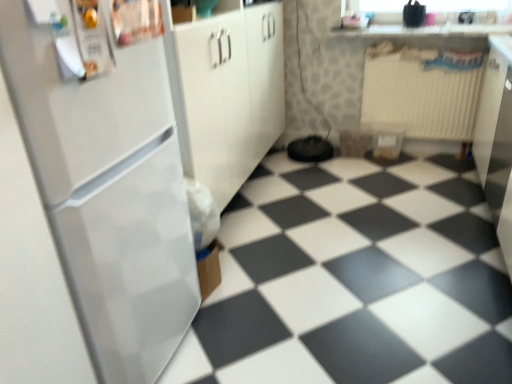
Locate an element on the screen. white glossy countertop at upper center is located at coordinates (424, 31).

Measure the distance between white glossy countertop at upper center and camera.

white glossy countertop at upper center and camera are 2.79 meters apart.

The width and height of the screenshot is (512, 384). I want to click on white plastic radiator at upper right, so click(x=421, y=90).

The height and width of the screenshot is (384, 512). Describe the element at coordinates (355, 279) in the screenshot. I see `white glossy tile at lower left` at that location.

Locate an element on the screen. white glossy countertop at upper center is located at coordinates (424, 31).

Considering the positions of point (472, 208) and point (41, 232), is point (472, 208) closer or farther from the camera than point (41, 232)?

Point (472, 208) is farther from the camera than point (41, 232).

Considering the relative sizes of white glossy tile at lower left and white glossy refrigerator at left in the image provided, is white glossy tile at lower left taller than white glossy refrigerator at left?

No.

At what (x,y) coordinates should I click in order to perform the action: click on tile behind the white glossy refrigerator at left. Please return your answer as a coordinate pair (x, y). This screenshot has height=384, width=512. Looking at the image, I should click on (355, 279).

Between white glossy tile at lower left and white glossy refrigerator at left, which one has larger width?

Wider between the two is white glossy tile at lower left.

Is white glossy tile at lower left oriented towards white glossy countertop at upper center?

No, white glossy tile at lower left is not facing towards white glossy countertop at upper center.

Is white glossy tile at lower left at the left side of white glossy countertop at upper center?

Yes, white glossy tile at lower left is to the left of white glossy countertop at upper center.

From the image's perspective, is white glossy tile at lower left positioned above or below white glossy countertop at upper center?

Based on their image positions, white glossy tile at lower left is located beneath white glossy countertop at upper center.

Between white glossy tile at lower left and white glossy countertop at upper center, which one has smaller size?

Smaller between the two is white glossy countertop at upper center.

Is white glossy tile at lower left completely or partially outside of white plastic radiator at upper right?

Indeed, white glossy tile at lower left is completely outside white plastic radiator at upper right.

Is white glossy tile at lower left taller or shorter than white plastic radiator at upper right?

In the image, white glossy tile at lower left appears to be shorter than white plastic radiator at upper right.

From the image's perspective, which one is positioned lower, white glossy tile at lower left or white plastic radiator at upper right?

white glossy tile at lower left, from the image's perspective.

Is white glossy tile at lower left touching white plastic radiator at upper right?

No, white glossy tile at lower left is not next to white plastic radiator at upper right.

Are white glossy refrigerator at left and white glossy countertop at upper center far apart?

Indeed, white glossy refrigerator at left is not near white glossy countertop at upper center.

Does white glossy refrigerator at left come behind white glossy countertop at upper center?

No.

Looking at this image, considering the relative positions of white glossy refrigerator at left and white glossy countertop at upper center in the image provided, is white glossy refrigerator at left to the left of white glossy countertop at upper center from the viewer's perspective?

Yes.

Based on the photo, is white glossy refrigerator at left located outside white glossy countertop at upper center?

Yes, white glossy refrigerator at left is not within white glossy countertop at upper center.

Is white plastic radiator at upper right positioned with its back to white glossy tile at lower left?

white plastic radiator at upper right does not have its back to white glossy tile at lower left.

From the image's perspective, does white plastic radiator at upper right appear higher than white glossy tile at lower left?

Yes, from the image's perspective, white plastic radiator at upper right is above white glossy tile at lower left.

Does white plastic radiator at upper right have a greater height compared to white glossy tile at lower left?

Correct, white plastic radiator at upper right is much taller as white glossy tile at lower left.

Is white plastic radiator at upper right further to the viewer compared to white glossy tile at lower left?

Yes, the depth of white plastic radiator at upper right is greater than that of white glossy tile at lower left.

Does white glossy refrigerator at left have a larger size compared to white plastic radiator at upper right?

Indeed, white glossy refrigerator at left has a larger size compared to white plastic radiator at upper right.

Could you tell me if white glossy refrigerator at left is facing white plastic radiator at upper right?

No, white glossy refrigerator at left is not facing towards white plastic radiator at upper right.

Looking at this image, does white glossy refrigerator at left have a greater width compared to white plastic radiator at upper right?

Yes, white glossy refrigerator at left is wider than white plastic radiator at upper right.

From the image's perspective, does white glossy countertop at upper center appear higher than white plastic radiator at upper right?

Indeed, from the image's perspective, white glossy countertop at upper center is shown above white plastic radiator at upper right.

Can you confirm if white glossy countertop at upper center is wider than white plastic radiator at upper right?

Indeed, white glossy countertop at upper center has a greater width compared to white plastic radiator at upper right.

Which is in front, white glossy countertop at upper center or white plastic radiator at upper right?

white glossy countertop at upper center is more forward.

How many degrees apart are the facing directions of white glossy countertop at upper center and white plastic radiator at upper right?

There is a 2.86-degree angle between the facing directions of white glossy countertop at upper center and white plastic radiator at upper right.

The width and height of the screenshot is (512, 384). In order to click on refrigerator on the left of the white glossy tile at lower left in this screenshot , I will do `click(89, 208)`.

Identify the location of tile below the white glossy countertop at upper center (from the image's perspective). (355, 279).

Considering their positions, is white plastic radiator at upper right positioned further to white glossy tile at lower left than white glossy refrigerator at left?

white plastic radiator at upper right lies further to white glossy tile at lower left than the other object.

Considering their positions, is white glossy countertop at upper center positioned closer to white glossy tile at lower left than white plastic radiator at upper right?

Based on the image, white plastic radiator at upper right appears to be nearer to white glossy tile at lower left.

When comparing their distances from white glossy refrigerator at left, does white glossy countertop at upper center or white plastic radiator at upper right seem further?

white glossy countertop at upper center.

From the image, which object appears to be farther from white plastic radiator at upper right, white glossy refrigerator at left or white glossy tile at lower left?

The object further to white plastic radiator at upper right is white glossy refrigerator at left.

Looking at the image, which one is located closer to white glossy tile at lower left, white glossy refrigerator at left or white glossy countertop at upper center?

Among the two, white glossy refrigerator at left is located nearer to white glossy tile at lower left.

Which object lies nearer to the anchor point white glossy countertop at upper center, white glossy tile at lower left or white glossy refrigerator at left?

white glossy tile at lower left.

Based on their spatial positions, is white glossy refrigerator at left or white glossy tile at lower left closer to white glossy countertop at upper center?

white glossy tile at lower left is positioned closer to the anchor white glossy countertop at upper center.

Which object lies nearer to the anchor point white glossy refrigerator at left, white plastic radiator at upper right or white glossy tile at lower left?

Among the two, white glossy tile at lower left is located nearer to white glossy refrigerator at left.

Locate an element on the screen. counter top positioned between white glossy tile at lower left and white plastic radiator at upper right from near to far is located at coordinates (424, 31).

The height and width of the screenshot is (384, 512). Find the location of `tile between white glossy refrigerator at left and white glossy countertop at upper center from front to back`. tile between white glossy refrigerator at left and white glossy countertop at upper center from front to back is located at coordinates (355, 279).

Where is `counter top positioned between white glossy refrigerator at left and white plastic radiator at upper right from near to far`? counter top positioned between white glossy refrigerator at left and white plastic radiator at upper right from near to far is located at coordinates (424, 31).

This screenshot has width=512, height=384. In order to click on tile positioned between white glossy refrigerator at left and white plastic radiator at upper right from near to far in this screenshot , I will do `click(355, 279)`.